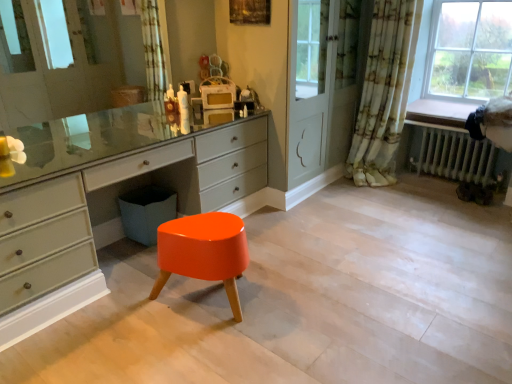
The height and width of the screenshot is (384, 512). Identify the location of vacant area that is in front of floral fabric curtain at right. (380, 203).